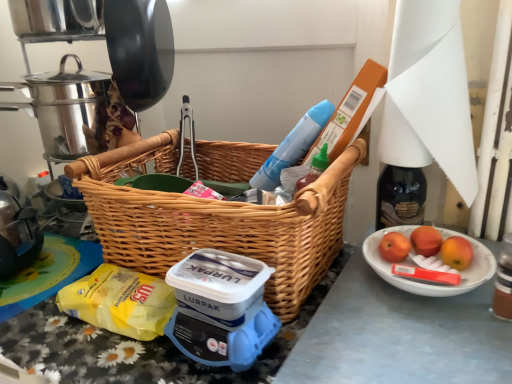
Locate an element on the screen. Image resolution: width=512 pixels, height=384 pixels. woven wood picnic basket at center is located at coordinates (216, 220).

Where is `shiny metallic crock pot at upper left`? The height and width of the screenshot is (384, 512). shiny metallic crock pot at upper left is located at coordinates (63, 106).

The image size is (512, 384). What do you see at coordinates (394, 247) in the screenshot?
I see `red matte apple at right, the first apple positioned from the left` at bounding box center [394, 247].

This screenshot has width=512, height=384. Identify the location of white ceramic bowl at lower right. (431, 284).

This screenshot has width=512, height=384. What do you see at coordinates (429, 94) in the screenshot?
I see `white paper at upper right` at bounding box center [429, 94].

Find the location of `red matte apple at right, positioned as the third apple in left-to-right order`. red matte apple at right, positioned as the third apple in left-to-right order is located at coordinates (457, 253).

This screenshot has width=512, height=384. In order to click on woven wood picnic basket at center in this screenshot , I will do `click(216, 220)`.

Consider the image. Considering the relative positions of shiny metallic crock pot at upper left and white ceramic bowl at lower right in the image provided, is shiny metallic crock pot at upper left to the left or to the right of white ceramic bowl at lower right?

Clearly, shiny metallic crock pot at upper left is on the left of white ceramic bowl at lower right in the image.

What's the angular difference between shiny metallic crock pot at upper left and white ceramic bowl at lower right's facing directions?

65.9 degrees.

Considering their positions, is shiny metallic crock pot at upper left located in front of or behind white ceramic bowl at lower right?

shiny metallic crock pot at upper left is behind white ceramic bowl at lower right.

From the picture: Is white ceramic bowl at lower right inside shiny metallic crock pot at upper left?

No, shiny metallic crock pot at upper left does not contain white ceramic bowl at lower right.

Is white ceramic bowl at lower right taller or shorter than shiny metallic crock pot at upper left?

Considering their sizes, white ceramic bowl at lower right has less height than shiny metallic crock pot at upper left.

At what (x,y) coordinates should I click in order to perform the action: click on bowl below the shiny metallic crock pot at upper left (from the image's perspective). Please return your answer as a coordinate pair (x, y). Looking at the image, I should click on [431, 284].

Is white ceramic bowl at lower right facing towards shiny metallic crock pot at upper left?

No, white ceramic bowl at lower right is not facing towards shiny metallic crock pot at upper left.

Based on the photo, considering the relative positions of white ceramic bowl at lower right and shiny metallic crock pot at upper left in the image provided, is white ceramic bowl at lower right behind shiny metallic crock pot at upper left?

No, it is in front of shiny metallic crock pot at upper left.

In the scene shown: Is yellow plastic bag at lower left placed right next to woven wood picnic basket at center?

yellow plastic bag at lower left and woven wood picnic basket at center are not in contact.

Considering the sizes of yellow plastic bag at lower left and woven wood picnic basket at center in the image, is yellow plastic bag at lower left bigger or smaller than woven wood picnic basket at center?

In the image, yellow plastic bag at lower left appears to be smaller than woven wood picnic basket at center.

Considering their positions, is yellow plastic bag at lower left located in front of or behind woven wood picnic basket at center?

In the image, yellow plastic bag at lower left appears behind woven wood picnic basket at center.

Is shiny metallic crock pot at upper left facing away from red matte apple at right, the second apple when ordered from left to right?

No, shiny metallic crock pot at upper left is not facing the opposite direction of red matte apple at right, the second apple when ordered from left to right.

What's the angular difference between shiny metallic crock pot at upper left and red matte apple at right, the second apple in the right-to-left sequence,'s facing directions?

65.9 degrees.

Which is in front, point (36, 76) or point (415, 233)?

Positioned in front is point (415, 233).

Can you see shiny metallic crock pot at upper left touching red matte apple at right, the second apple when ordered from left to right?

No, shiny metallic crock pot at upper left is not next to red matte apple at right, the second apple when ordered from left to right.

Is white paper at upper right looking in the opposite direction of woven wood picnic basket at center?

No, white paper at upper right is not facing the opposite direction of woven wood picnic basket at center.

From the image's perspective, is white paper at upper right positioned above or below woven wood picnic basket at center?

Based on their image positions, white paper at upper right is located above woven wood picnic basket at center.

In terms of width, does white paper at upper right look wider or thinner when compared to woven wood picnic basket at center?

In the image, white paper at upper right appears to be more narrow than woven wood picnic basket at center.

From the image's perspective, is white paper at upper right over red matte apple at right, the second apple in the right-to-left sequence?

Yes, from the image's perspective, white paper at upper right is over red matte apple at right, the second apple in the right-to-left sequence.

Based on the photo, is white paper at upper right oriented towards red matte apple at right, the second apple in the right-to-left sequence?

No, white paper at upper right is not turned towards red matte apple at right, the second apple in the right-to-left sequence.

Is white paper at upper right with red matte apple at right, the second apple when ordered from left to right?

No, white paper at upper right is not touching red matte apple at right, the second apple when ordered from left to right.

Based on their positions, is white paper at upper right located to the left or right of red matte apple at right, the second apple in the right-to-left sequence?

white paper at upper right is to the left of red matte apple at right, the second apple in the right-to-left sequence.

Identify the location of paper towel above the woven wood picnic basket at center (from the image's perspective). This screenshot has height=384, width=512. (429, 94).

Considering the relative sizes of woven wood picnic basket at center and white paper at upper right in the image provided, is woven wood picnic basket at center taller than white paper at upper right?

No.

Does point (238, 172) lie in front of point (466, 100)?

No, it is behind (466, 100).

Would you say woven wood picnic basket at center is a long distance from white paper at upper right?

No.

Find the location of a particular element. Image resolution: width=512 pixels, height=384 pixels. bowl on the right of shiny metallic crock pot at upper left is located at coordinates (431, 284).

Where is `crock pot that is on the left side of white ceramic bowl at lower right`? This screenshot has height=384, width=512. crock pot that is on the left side of white ceramic bowl at lower right is located at coordinates (63, 106).

When comparing their distances from white paper at upper right, does red matte apple at right, the second apple when ordered from left to right, or red matte apple at right, positioned as the first apple in right-to-left order, seem closer?

red matte apple at right, the second apple when ordered from left to right.

From the image, which object appears to be farther from white paper at upper right, woven wood picnic basket at center or red matte apple at right, positioned as the third apple in left-to-right order?

woven wood picnic basket at center lies further to white paper at upper right than the other object.

In the scene shown: Looking at the image, which one is located further to yellow plastic bag at lower left, red matte apple at right, the second apple in the right-to-left sequence, or white paper at upper right?

white paper at upper right is further to yellow plastic bag at lower left.

Considering their positions, is white paper at upper right positioned further to yellow plastic bag at lower left than red matte apple at right, positioned as the first apple in right-to-left order?

The object further to yellow plastic bag at lower left is white paper at upper right.

Considering their positions, is yellow plastic bag at lower left positioned closer to red matte apple at right, the first apple positioned from the left, than red matte apple at right, positioned as the first apple in right-to-left order?

red matte apple at right, positioned as the first apple in right-to-left order, lies closer to red matte apple at right, the first apple positioned from the left, than the other object.

Estimate the real-world distances between objects in this image. Which object is closer to white ceramic bowl at lower right, woven wood picnic basket at center or red matte apple at right, positioned as the third apple in left-to-right order?

red matte apple at right, positioned as the third apple in left-to-right order.

When comparing their distances from yellow plastic bag at lower left, does white ceramic bowl at lower right or red matte apple at right, the first apple positioned from the left, seem further?

Based on the image, red matte apple at right, the first apple positioned from the left, appears to be further to yellow plastic bag at lower left.

When comparing their distances from red matte apple at right, positioned as the first apple in right-to-left order, does red matte apple at right, the second apple in the right-to-left sequence, or shiny metallic crock pot at upper left seem closer?

Among the two, red matte apple at right, the second apple in the right-to-left sequence, is located nearer to red matte apple at right, positioned as the first apple in right-to-left order.

Where is `paper towel situated between yellow plastic bag at lower left and red matte apple at right, positioned as the first apple in right-to-left order, from left to right`? This screenshot has height=384, width=512. paper towel situated between yellow plastic bag at lower left and red matte apple at right, positioned as the first apple in right-to-left order, from left to right is located at coordinates [x=429, y=94].

What are the coordinates of `apple between shiny metallic crock pot at upper left and white paper at upper right in the horizontal direction` in the screenshot? It's located at (394, 247).

The image size is (512, 384). I want to click on food between shiny metallic crock pot at upper left and red matte apple at right, positioned as the first apple in right-to-left order, so click(x=120, y=302).

The width and height of the screenshot is (512, 384). What are the coordinates of `bowl between woven wood picnic basket at center and red matte apple at right, the second apple in the right-to-left sequence` in the screenshot? It's located at (431, 284).